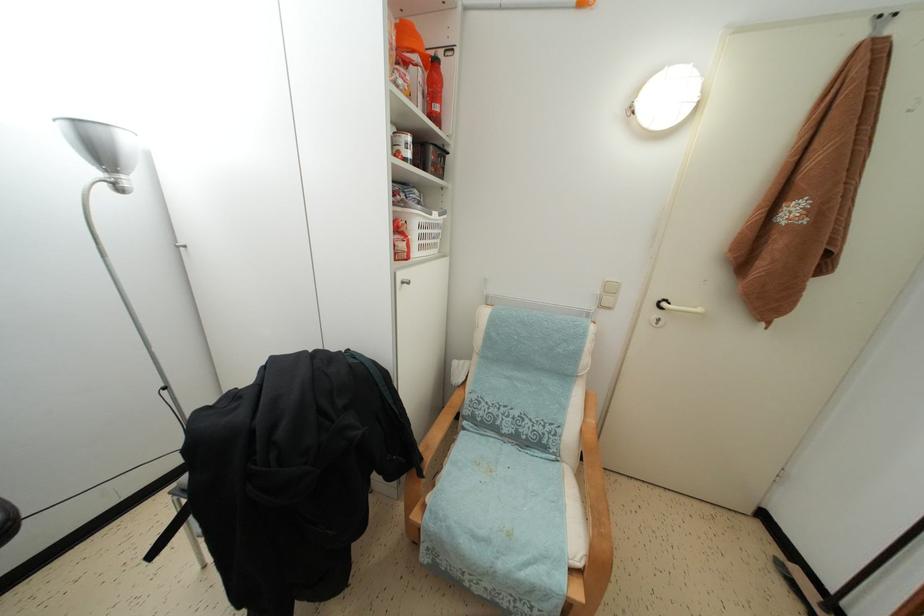
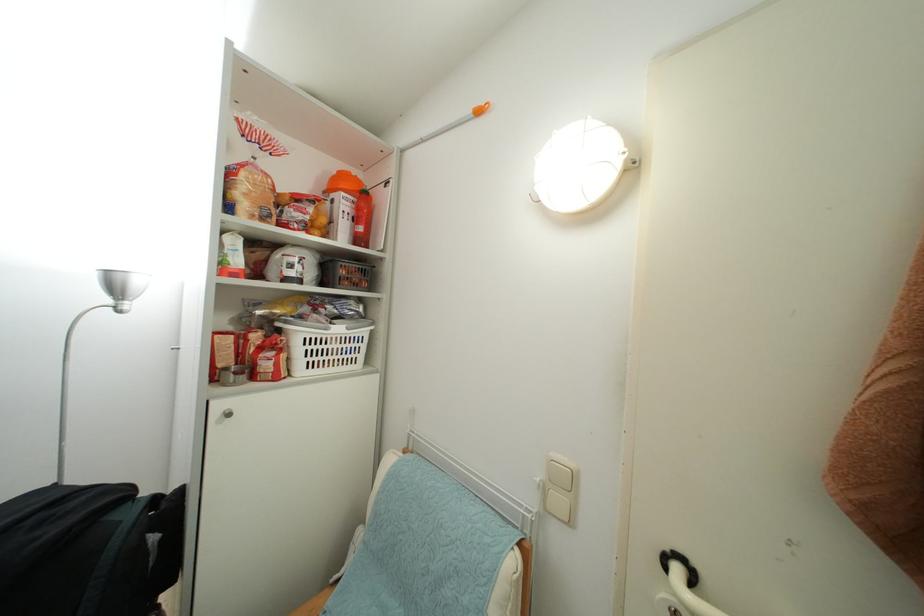
The point at (441, 113) is marked in the first image. Where is the corresponding point in the second image?

(365, 235)